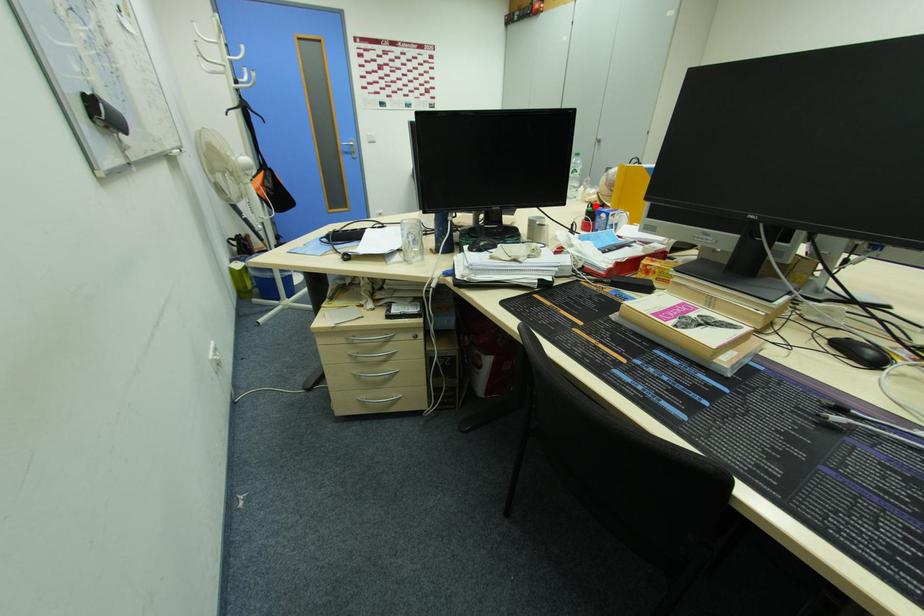
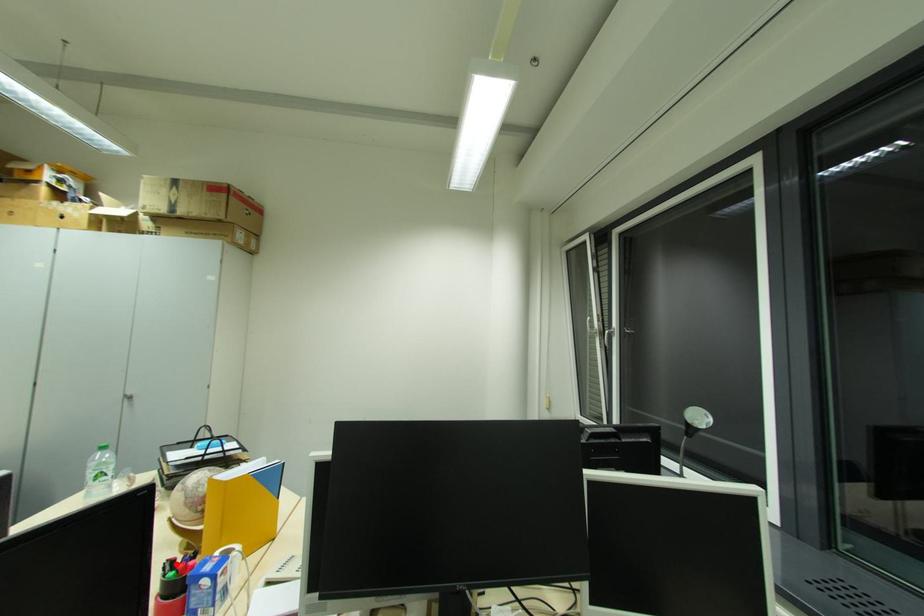
I am providing you with two images of the same scene from different viewpoints. A red point is marked on the first image and another point is marked on the second image. Is the red point in image1 aligned with the point shown in image2?

Yes